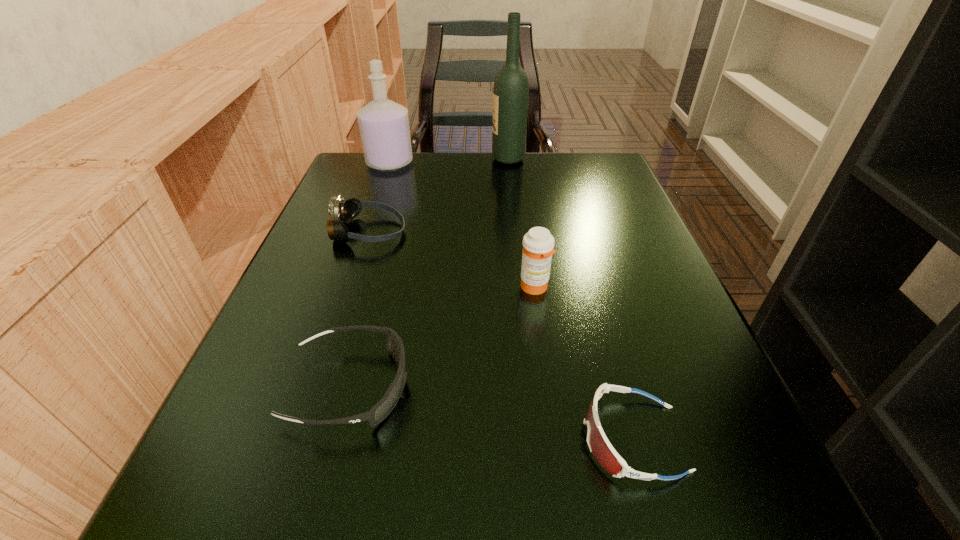
Identify the location of wine bottle. The height and width of the screenshot is (540, 960). (511, 87).

At what (x,y) coordinates should I click in order to perform the action: click on the second tallest object. Please return your answer as a coordinate pair (x, y). The height and width of the screenshot is (540, 960). Looking at the image, I should click on (384, 124).

Where is `medicine`? medicine is located at coordinates (538, 244).

Where is `the third nearest object`? Image resolution: width=960 pixels, height=540 pixels. the third nearest object is located at coordinates click(x=538, y=244).

I want to click on the farthest goggles, so click(345, 211).

I want to click on the rightmost goggles, so click(x=599, y=445).

The width and height of the screenshot is (960, 540). I want to click on vacant point located 0.210m on the labeled side of the tallest object, so click(402, 159).

Image resolution: width=960 pixels, height=540 pixels. I want to click on free space located 0.340m on the labeled side of the tallest object, so click(347, 159).

This screenshot has width=960, height=540. I want to click on free space located on the labeled side of the tallest object, so click(x=406, y=159).

Locate an element on the screen. The image size is (960, 540). vacant region located on the front of the perfume is located at coordinates (368, 228).